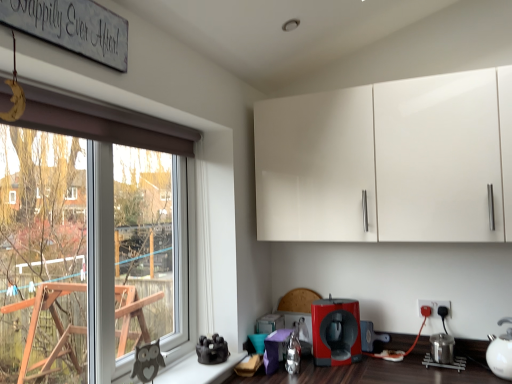
Question: Does point (444, 304) appear closer or farther from the camera than point (501, 347)?

Choices:
 (A) farther
 (B) closer

Answer: (A)

Question: In the image, is matte black electric outlet at lower right positioned in front of or behind white glossy tea pot at lower right?

Choices:
 (A) behind
 (B) front

Answer: (A)

Question: Which is farther from the matte red coffee machine at lower center, the 1th coffee machine in the right-to-left sequence?

Choices:
 (A) matte red coffee machine at lower center, the second coffee machine from the right
 (B) matte black electric outlet at lower right
 (C) white glossy tea pot at lower right
 (D) white glossy cabinet at upper center
 (E) wooden signboard at upper left

Answer: (E)

Question: Which object is positioned closest to the white glossy tea pot at lower right?

Choices:
 (A) white glossy cabinet at upper center
 (B) wooden signboard at upper left
 (C) matte red coffee machine at lower center, acting as the first coffee machine starting from the front
 (D) matte red coffee machine at lower center, the 1th coffee machine in the right-to-left sequence
 (E) matte black electric outlet at lower right

Answer: (E)